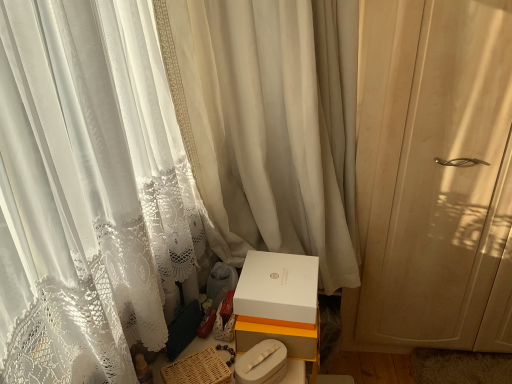
Locate an element on the screen. The height and width of the screenshot is (384, 512). free space above white matte box at lower center, the second box when ordered from bottom to top (from a real-world perspective) is located at coordinates pos(264,277).